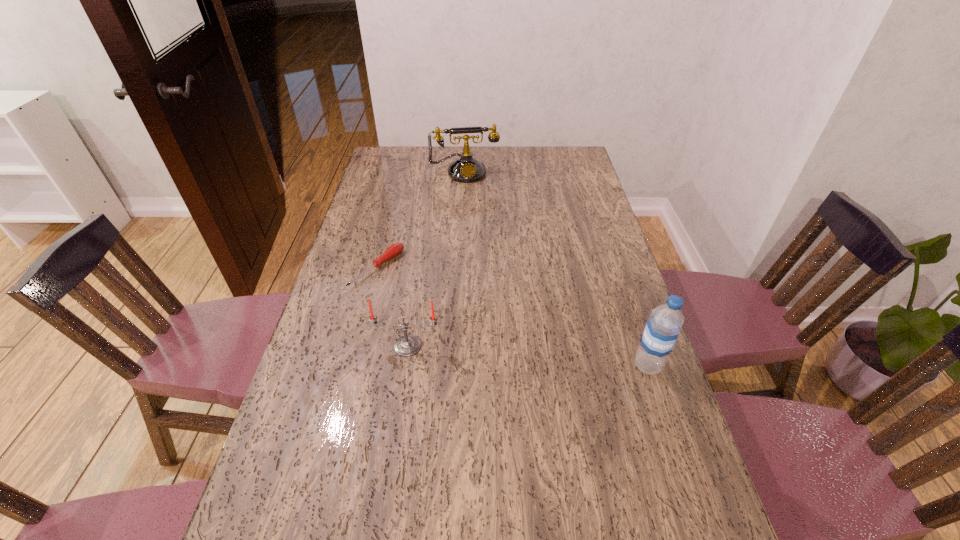
Where is `free space on the desktop that is between the candle and the rightmost object and is positioned at the tip of the screwdriver`? This screenshot has height=540, width=960. free space on the desktop that is between the candle and the rightmost object and is positioned at the tip of the screwdriver is located at coordinates (536, 356).

Where is `vacant space on the desktop that is between the candle and the rightmost object and is positioned on the dial of the farthest object`? Image resolution: width=960 pixels, height=540 pixels. vacant space on the desktop that is between the candle and the rightmost object and is positioned on the dial of the farthest object is located at coordinates (496, 353).